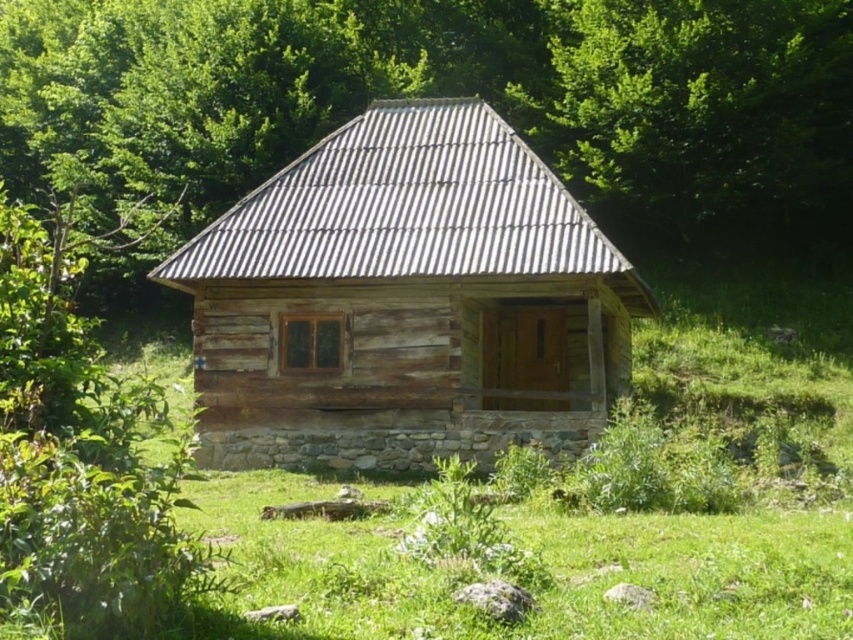
Question: Can you confirm if green leafy tree at upper center is positioned to the right of weathered wood log cabin at center?

Choices:
 (A) yes
 (B) no

Answer: (B)

Question: Among these objects, which one is farthest from the camera?

Choices:
 (A) weathered wood log cabin at center
 (B) green leafy tree at upper center

Answer: (B)

Question: Where is green leafy tree at upper center located in relation to weathered wood log cabin at center in the image?

Choices:
 (A) below
 (B) above

Answer: (B)

Question: Among these objects, which one is farthest from the camera?

Choices:
 (A) green leafy tree at upper center
 (B) weathered wood log cabin at center

Answer: (A)

Question: Does green leafy tree at upper center have a smaller size compared to weathered wood log cabin at center?

Choices:
 (A) no
 (B) yes

Answer: (A)

Question: Which object is closer to the camera taking this photo?

Choices:
 (A) weathered wood log cabin at center
 (B) green leafy tree at upper center

Answer: (A)